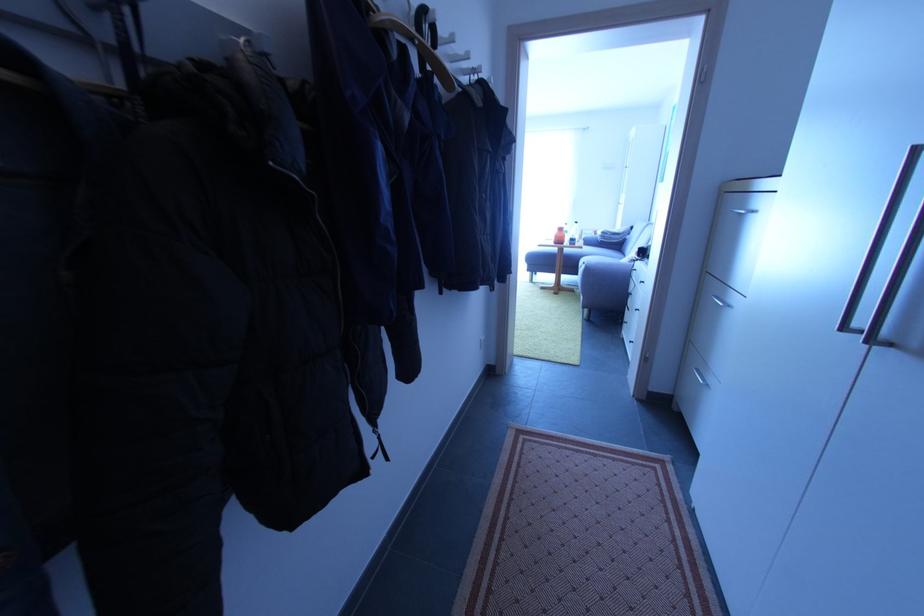
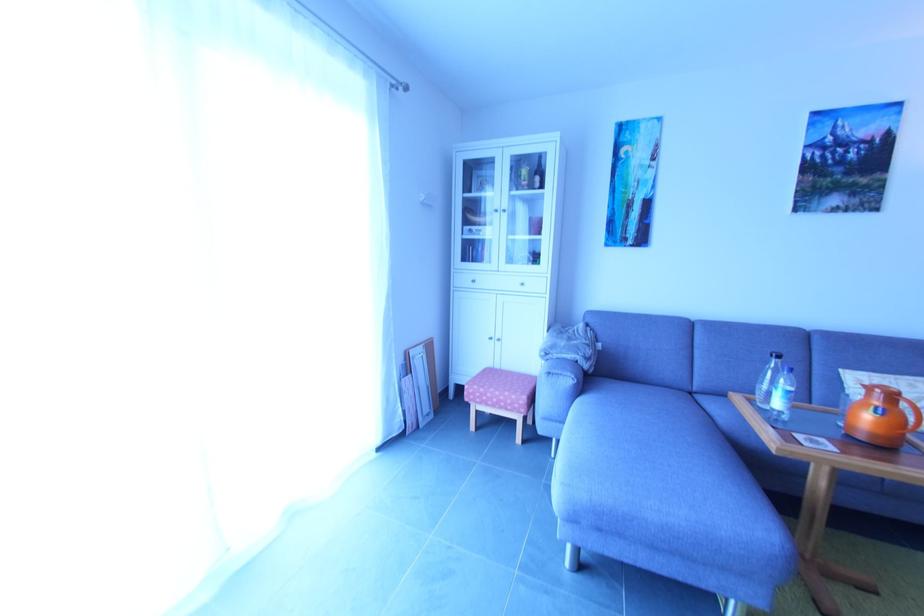
In the second image, find the point that corresponds to point 584,235 in the first image.

(406, 362)